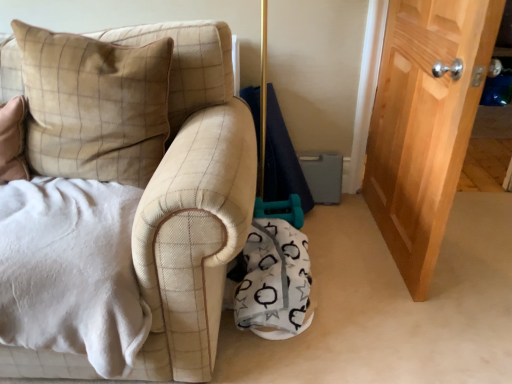
What are the coordinates of `wooden door at right` in the screenshot? It's located at (425, 124).

Measure the distance between point (416, 246) and camera.

Point (416, 246) and camera are 5.00 feet apart from each other.

What is the approximate width of beige velvety pillow at left?

8.46 inches.

This screenshot has width=512, height=384. I want to click on wooden door at right, so pyautogui.click(x=425, y=124).

From the image's perspective, does white fabric blanket at lower center appear lower than wooden door at right?

Indeed, from the image's perspective, white fabric blanket at lower center is shown beneath wooden door at right.

Is the surface of white fabric blanket at lower center in direct contact with wooden door at right?

No, white fabric blanket at lower center is not in contact with wooden door at right.

In terms of size, does white fabric blanket at lower center appear bigger or smaller than wooden door at right?

white fabric blanket at lower center is smaller than wooden door at right.

From the image's perspective, between wooden door at right and beige velvety pillow at left, who is located below?

beige velvety pillow at left, from the image's perspective.

Can you confirm if wooden door at right is smaller than beige velvety pillow at left?

Incorrect, wooden door at right is not smaller in size than beige velvety pillow at left.

Considering the positions of objects wooden door at right and beige velvety pillow at left in the image provided, who is more to the left, wooden door at right or beige velvety pillow at left?

beige velvety pillow at left.

From the image's perspective, who appears lower, beige velvety pillow at left or wooden door at right?

beige velvety pillow at left is shown below in the image.

Looking at this image, considering the relative positions of beige velvety pillow at left and wooden door at right in the image provided, is beige velvety pillow at left in front of wooden door at right?

Yes.

Is beige velvety pillow at left taller or shorter than wooden door at right?

Clearly, beige velvety pillow at left is shorter compared to wooden door at right.

Which is correct: beige velvety pillow at left is inside white fabric blanket at lower center, or outside of it?

The correct answer is: outside.

From the image's perspective, is beige velvety pillow at left positioned above or below white fabric blanket at lower center?

From the image's perspective, beige velvety pillow at left appears above white fabric blanket at lower center.

Is beige velvety pillow at left thinner than white fabric blanket at lower center?

Indeed, beige velvety pillow at left has a lesser width compared to white fabric blanket at lower center.

Consider the image. Which is behind, beige velvety pillow at left or white fabric blanket at lower center?

white fabric blanket at lower center is further from the camera.

Between white fabric blanket at lower center and beige velvety pillow at left, which one has more height?

With more height is beige velvety pillow at left.

Considering the positions of point (261, 277) and point (48, 137), is point (261, 277) closer or farther from the camera than point (48, 137)?

Point (261, 277).

Is white fabric blanket at lower center in front of or behind beige velvety pillow at left in the image?

In the image, white fabric blanket at lower center appears behind beige velvety pillow at left.

Is white fabric blanket at lower center aimed at beige velvety pillow at left?

No, white fabric blanket at lower center is not aimed at beige velvety pillow at left.

Based on the photo, which object is wider, wooden door at right or white fabric blanket at lower center?

With larger width is white fabric blanket at lower center.

Between wooden door at right and white fabric blanket at lower center, which one has less height?

white fabric blanket at lower center.

In order to click on door on the right of the white fabric blanket at lower center in this screenshot , I will do (425, 124).

Looking at the image, does wooden door at right seem bigger or smaller compared to white fabric blanket at lower center?

Clearly, wooden door at right is larger in size than white fabric blanket at lower center.

In order to click on material in front of the wooden door at right in this screenshot , I will do `click(274, 281)`.

At what (x,y) coordinates should I click in order to perform the action: click on door that appears on the right of beige velvety pillow at left. Please return your answer as a coordinate pair (x, y). This screenshot has height=384, width=512. Looking at the image, I should click on (x=425, y=124).

Estimate the real-world distances between objects in this image. Which object is closer to wooden door at right, white fabric blanket at lower center or beige velvety pillow at left?

white fabric blanket at lower center is closer to wooden door at right.

Estimate the real-world distances between objects in this image. Which object is further from white fabric blanket at lower center, wooden door at right or beige velvety pillow at left?

Among the two, beige velvety pillow at left is located further to white fabric blanket at lower center.

Which object lies nearer to the anchor point wooden door at right, beige velvety pillow at left or white fabric blanket at lower center?

Based on the image, white fabric blanket at lower center appears to be nearer to wooden door at right.

Estimate the real-world distances between objects in this image. Which object is closer to white fabric blanket at lower center, beige velvety pillow at left or wooden door at right?

wooden door at right.

Looking at the image, which one is located closer to beige velvety pillow at left, wooden door at right or white fabric blanket at lower center?

The object closer to beige velvety pillow at left is white fabric blanket at lower center.

From the image, which object appears to be nearer to beige velvety pillow at left, white fabric blanket at lower center or wooden door at right?

white fabric blanket at lower center.

What are the coordinates of `material between beige velvety pillow at left and wooden door at right in the horizontal direction` in the screenshot? It's located at pos(274,281).